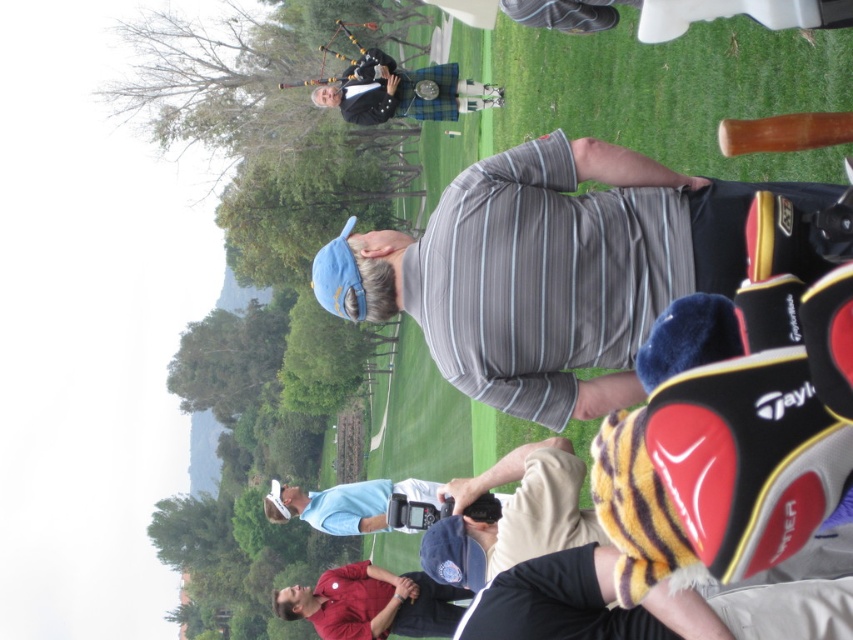
Question: Can you confirm if matte red shirt at lower center is thinner than plaid fabric kilt at upper center?

Choices:
 (A) yes
 (B) no

Answer: (A)

Question: Estimate the real-world distances between objects in this image. Which object is closer to the matte red shirt at lower center?

Choices:
 (A) gray striped shirt at center
 (B) plaid fabric kilt at upper center

Answer: (A)

Question: Which of these objects is positioned closest to the matte red shirt at lower center?

Choices:
 (A) gray striped shirt at center
 (B) plaid fabric kilt at upper center

Answer: (A)

Question: Is gray striped shirt at center wider than matte red shirt at lower center?

Choices:
 (A) no
 (B) yes

Answer: (B)

Question: Does matte red shirt at lower center appear on the right side of plaid fabric kilt at upper center?

Choices:
 (A) no
 (B) yes

Answer: (B)

Question: Which point is closer to the camera taking this photo?

Choices:
 (A) (322, 576)
 (B) (456, 106)
 (C) (631, 228)

Answer: (C)